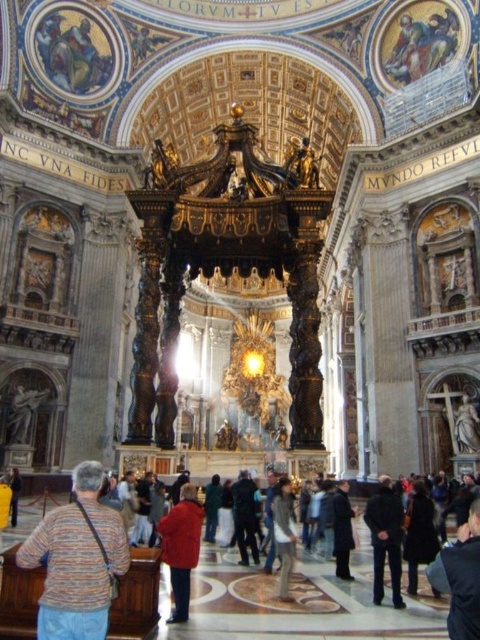
Is red wool coat at center to the left of dark gray fabric jacket at lower right from the viewer's perspective?

Indeed, red wool coat at center is positioned on the left side of dark gray fabric jacket at lower right.

Who is more forward, [159,518] or [394,545]?

Positioned in front is point [394,545].

Locate an element on the screen. red wool coat at center is located at coordinates (180, 547).

Measure the distance from dark gray fabric jacket at lower right to dark brown leather jacket at lower right.

dark gray fabric jacket at lower right is 6.48 feet away from dark brown leather jacket at lower right.

Is dark gray fabric jacket at lower right shorter than dark brown leather jacket at lower right?

In fact, dark gray fabric jacket at lower right may be taller than dark brown leather jacket at lower right.

At what (x,y) coordinates should I click in order to perform the action: click on dark gray fabric jacket at lower right. Please return your answer as a coordinate pair (x, y). Looking at the image, I should click on (385, 538).

Locate an element on the screen. This screenshot has width=480, height=640. dark gray fabric jacket at lower right is located at coordinates (385, 538).

From the picture: How distant is dark gray fabric jacket at lower right from dark brown leather coat at center?

The distance of dark gray fabric jacket at lower right from dark brown leather coat at center is 3.38 meters.

Which is behind, point (399, 605) or point (338, 522)?

Point (338, 522)

Is point (392, 516) positioned after point (348, 516)?

That is False.

Where is `dark gray fabric jacket at lower right`? The height and width of the screenshot is (640, 480). dark gray fabric jacket at lower right is located at coordinates (385, 538).